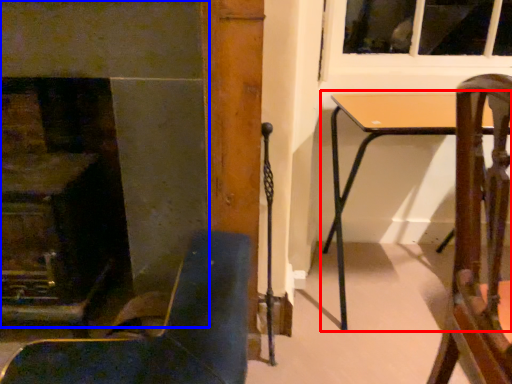
Question: Which object appears farthest to the camera in this image, table (highlighted by a red box) or fireplace (highlighted by a blue box)?

Choices:
 (A) table
 (B) fireplace

Answer: (A)